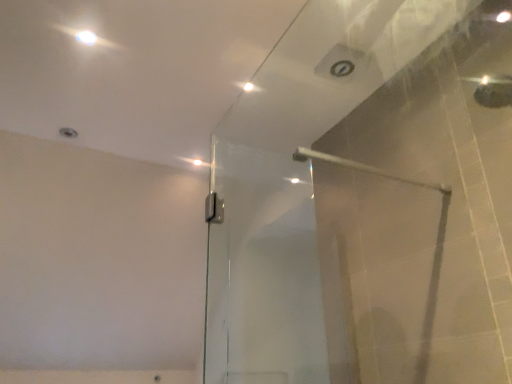
The height and width of the screenshot is (384, 512). What are the coordinates of `white glossy light fixture at upper left` in the screenshot? It's located at (86, 37).

Image resolution: width=512 pixels, height=384 pixels. Describe the element at coordinates (86, 37) in the screenshot. I see `white glossy light fixture at upper left` at that location.

This screenshot has width=512, height=384. Identify the location of white glossy light fixture at upper left. (86, 37).